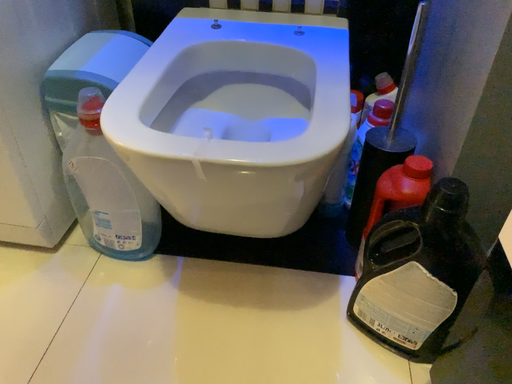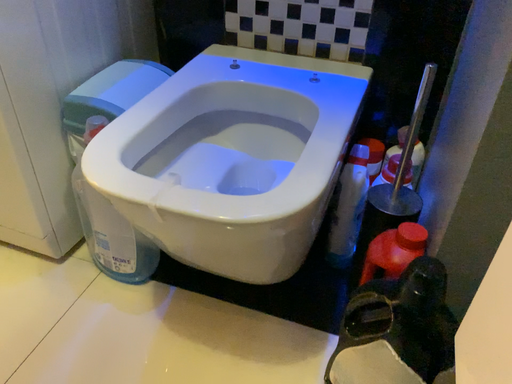
Question: Which way did the camera rotate in the video?

Choices:
 (A) rotated right
 (B) rotated left

Answer: (B)